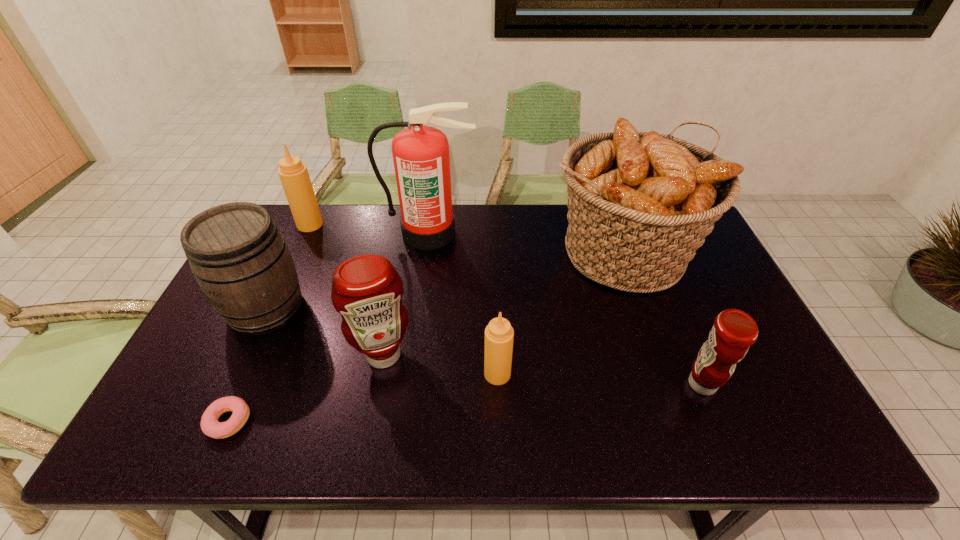
Find the location of `vacant area located 0.390m on the back of the right tan condiment`. vacant area located 0.390m on the back of the right tan condiment is located at coordinates (493, 260).

Find the location of a particular element. The width and height of the screenshot is (960, 540). vacant space located 0.300m on the right of the shortest object is located at coordinates (383, 422).

Locate an element on the screen. The height and width of the screenshot is (540, 960). fire extinguisher at the far edge is located at coordinates (421, 158).

Identify the location of basket at the far edge. (640, 204).

Identify the location of condiment that is at the far edge. Image resolution: width=960 pixels, height=540 pixels. (294, 176).

Image resolution: width=960 pixels, height=540 pixels. Identify the location of object that is at the near edge. (210, 425).

Where is `condiment that is at the left edge`? condiment that is at the left edge is located at coordinates (294, 176).

Locate an element on the screen. This screenshot has height=540, width=960. wine bucket positioned at the left edge is located at coordinates (240, 260).

Identify the location of doughnut that is at the left edge. This screenshot has width=960, height=540. (210, 425).

You are a GUI agent. You are given a task and a screenshot of the screen. Output one action in this format:
    pyautogui.click(x=<x>, y=<y>)
    Task: Click on the basket that is at the right edge
    The image size is (960, 540).
    Given the screenshot: What is the action you would take?
    pyautogui.click(x=640, y=204)